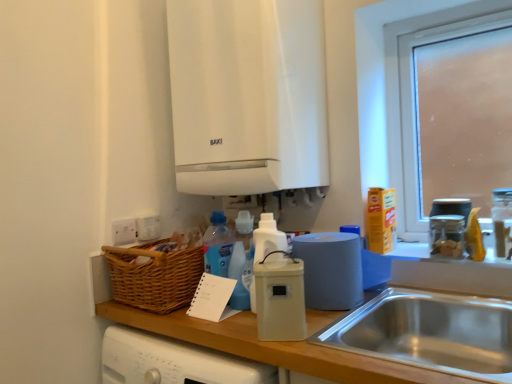
The width and height of the screenshot is (512, 384). What do you see at coordinates (413, 93) in the screenshot?
I see `frosted glass window at upper right` at bounding box center [413, 93].

Image resolution: width=512 pixels, height=384 pixels. What do you see at coordinates (447, 235) in the screenshot?
I see `clear glass jar at right` at bounding box center [447, 235].

Locate an element on the screen. This screenshot has width=512, height=384. frosted glass window at upper right is located at coordinates (413, 93).

Would you say frosted glass window at upper right contains matte plastic roll of paper towels at center, arranged as the first kitchen appliance when viewed from the back?

No.

Looking at this image, what's the angular difference between frosted glass window at upper right and matte plastic roll of paper towels at center, the second kitchen appliance positioned from the front,'s facing directions?

The angle between the facing direction of frosted glass window at upper right and the facing direction of matte plastic roll of paper towels at center, the second kitchen appliance positioned from the front, is 7.37 degrees.

From the picture: Is frosted glass window at upper right aimed at matte plastic roll of paper towels at center, arranged as the first kitchen appliance when viewed from the back?

Yes, frosted glass window at upper right is oriented towards matte plastic roll of paper towels at center, arranged as the first kitchen appliance when viewed from the back.

Locate an element on the screen. This screenshot has height=384, width=512. window sill behind the stainless steel sink at lower right is located at coordinates (410, 251).

From a real-world perspective, is stainless steel sink at lower right located higher than blue matte paper towel roll at right?

No, from a real-world perspective, stainless steel sink at lower right is not above blue matte paper towel roll at right.

How different are the orientations of stainless steel sink at lower right and blue matte paper towel roll at right in degrees?

The angle between the facing direction of stainless steel sink at lower right and the facing direction of blue matte paper towel roll at right is 0.321 degrees.

From the image's perspective, is stainless steel sink at lower right on top of blue matte paper towel roll at right?

Actually, stainless steel sink at lower right appears below blue matte paper towel roll at right in the image.

Is wooden at lower left to the left or to the right of white matte boiler at upper center in the image?

From the image, it's evident that wooden at lower left is to the right of white matte boiler at upper center.

Based on the photo, between wooden at lower left and white matte boiler at upper center, which one has less height?

Standing shorter between the two is wooden at lower left.

From the image's perspective, which is below, wooden at lower left or white matte boiler at upper center?

From the image's view, wooden at lower left is below.

From a real-world perspective, which object rests below the other?

wooden at lower left.

From the picture: Considering the sizes of objects matte plastic roll of paper towels at center, arranged as the first kitchen appliance when viewed from the back, and blue matte paper towel roll at right in the image provided, who is smaller, matte plastic roll of paper towels at center, arranged as the first kitchen appliance when viewed from the back, or blue matte paper towel roll at right?

Smaller between the two is blue matte paper towel roll at right.

Would you consider matte plastic roll of paper towels at center, arranged as the first kitchen appliance when viewed from the back, to be distant from blue matte paper towel roll at right?

No.

From the picture: From a real-world perspective, is matte plastic roll of paper towels at center, arranged as the first kitchen appliance when viewed from the back, above or below blue matte paper towel roll at right?

In terms of real-world spatial position, matte plastic roll of paper towels at center, arranged as the first kitchen appliance when viewed from the back, is above blue matte paper towel roll at right.

From the image's perspective, is matte plastic roll of paper towels at center, the second kitchen appliance positioned from the front, above or below blue matte paper towel roll at right?

Based on their image positions, matte plastic roll of paper towels at center, the second kitchen appliance positioned from the front, is located beneath blue matte paper towel roll at right.

Is wooden at lower left aimed at white plastic bottle at center, acting as the 1th bottle starting from the left?

No, wooden at lower left is not turned towards white plastic bottle at center, acting as the 1th bottle starting from the left.

What's the angular difference between wooden at lower left and white plastic bottle at center, acting as the 2th bottle starting from the right,'s facing directions?

97.6 degrees separate the facing orientations of wooden at lower left and white plastic bottle at center, acting as the 2th bottle starting from the right.

Is wooden at lower left at the right side of white plastic bottle at center, acting as the 1th bottle starting from the left?

Yes.

Is point (458, 267) farther from viewer compared to point (269, 239)?

Yes.

Is stainless steel sink at lower right inside the boundaries of clear glass jar at upper right, placed as the first bottle when sorted from right to left, or outside?

stainless steel sink at lower right exists outside the volume of clear glass jar at upper right, placed as the first bottle when sorted from right to left.

Can you confirm if stainless steel sink at lower right is smaller than clear glass jar at upper right, placed as the 2th bottle when sorted from left to right?

No.

From a real-world perspective, is stainless steel sink at lower right on clear glass jar at upper right, placed as the 2th bottle when sorted from left to right?

No, from a real-world perspective, stainless steel sink at lower right is not over clear glass jar at upper right, placed as the 2th bottle when sorted from left to right

Does point (415, 352) come in front of point (502, 257)?

Yes, it is.

Relative to stainless steel sink at lower right, is white matte boiler at upper center in front or behind?

Visually, white matte boiler at upper center is located behind stainless steel sink at lower right.

Between point (285, 125) and point (389, 293), which one is positioned behind?

The point (389, 293) is more distant.

Is white matte boiler at upper center facing towards stainless steel sink at lower right?

No, white matte boiler at upper center is not oriented towards stainless steel sink at lower right.

At what (x,y) coordinates should I click in order to perform the action: click on the 1st kitchen appliance in front of the frosted glass window at upper right, starting your count from the anchor. Please return your answer as a coordinate pair (x, y). Looking at the image, I should click on (330, 269).

The height and width of the screenshot is (384, 512). In order to click on sink below the blue matte paper towel roll at right (from a real-world perspective) in this screenshot , I will do `click(430, 332)`.

From the image, which object appears to be nearer to clear glass jar at upper right, placed as the 2th bottle when sorted from left to right, frosted glass window at upper right or blue matte paper towel roll at right?

blue matte paper towel roll at right lies closer to clear glass jar at upper right, placed as the 2th bottle when sorted from left to right, than the other object.

Estimate the real-world distances between objects in this image. Which object is closer to clear glass jar at upper right, placed as the 2th bottle when sorted from left to right, blue matte paper towel roll at right or stainless steel sink at lower right?

blue matte paper towel roll at right lies closer to clear glass jar at upper right, placed as the 2th bottle when sorted from left to right, than the other object.

Which object lies nearer to the anchor point wooden at lower left, white plastic bottle at center, acting as the 1th bottle starting from the left, or matte plastic roll of paper towels at center, the second kitchen appliance positioned from the front?

Based on the image, matte plastic roll of paper towels at center, the second kitchen appliance positioned from the front, appears to be nearer to wooden at lower left.

Estimate the real-world distances between objects in this image. Which object is closer to clear glass jar at right, matte plastic roll of paper towels at center, the second kitchen appliance positioned from the front, or white plastic container at center, which is the first kitchen appliance from front to back?

Among the two, matte plastic roll of paper towels at center, the second kitchen appliance positioned from the front, is located nearer to clear glass jar at right.

Estimate the real-world distances between objects in this image. Which object is closer to frosted glass window at upper right, clear glass jar at upper right, placed as the first bottle when sorted from right to left, or white plastic container at center, which appears as the second kitchen appliance when viewed from the back?

Based on the image, clear glass jar at upper right, placed as the first bottle when sorted from right to left, appears to be nearer to frosted glass window at upper right.

Looking at the image, which one is located closer to clear glass jar at right, frosted glass window at upper right or clear glass jar at upper right, placed as the 2th bottle when sorted from left to right?

clear glass jar at upper right, placed as the 2th bottle when sorted from left to right, lies closer to clear glass jar at right than the other object.

Considering their positions, is white plastic container at center, which appears as the second kitchen appliance when viewed from the back, positioned closer to white plastic bottle at center, acting as the 1th bottle starting from the left, than matte plastic roll of paper towels at center, arranged as the first kitchen appliance when viewed from the back?

white plastic container at center, which appears as the second kitchen appliance when viewed from the back, is positioned closer to the anchor white plastic bottle at center, acting as the 1th bottle starting from the left.

Based on their spatial positions, is white plastic bottle at center, acting as the 2th bottle starting from the right, or frosted glass window at upper right further from wooden at lower left?

frosted glass window at upper right is further to wooden at lower left.

At what (x,y) coordinates should I click in order to perform the action: click on sink between wooden at lower left and blue matte paper towel roll at right from front to back. Please return your answer as a coordinate pair (x, y). This screenshot has height=384, width=512. Looking at the image, I should click on (430, 332).

You are a GUI agent. You are given a task and a screenshot of the screen. Output one action in this format:
    pyautogui.click(x=<x>, y=<y>)
    Task: Click on the sink between white plastic container at center, which is the first kitchen appliance from front to back, and clear glass jar at right from left to right
    The width and height of the screenshot is (512, 384).
    Given the screenshot: What is the action you would take?
    pyautogui.click(x=430, y=332)

Where is `window sill between wooden at lower left and clear glass jar at right along the z-axis`? The image size is (512, 384). window sill between wooden at lower left and clear glass jar at right along the z-axis is located at coordinates (410, 251).

Image resolution: width=512 pixels, height=384 pixels. In order to click on sink between white plastic bottle at center, acting as the 2th bottle starting from the right, and frosted glass window at upper right, in the horizontal direction in this screenshot , I will do `click(430, 332)`.